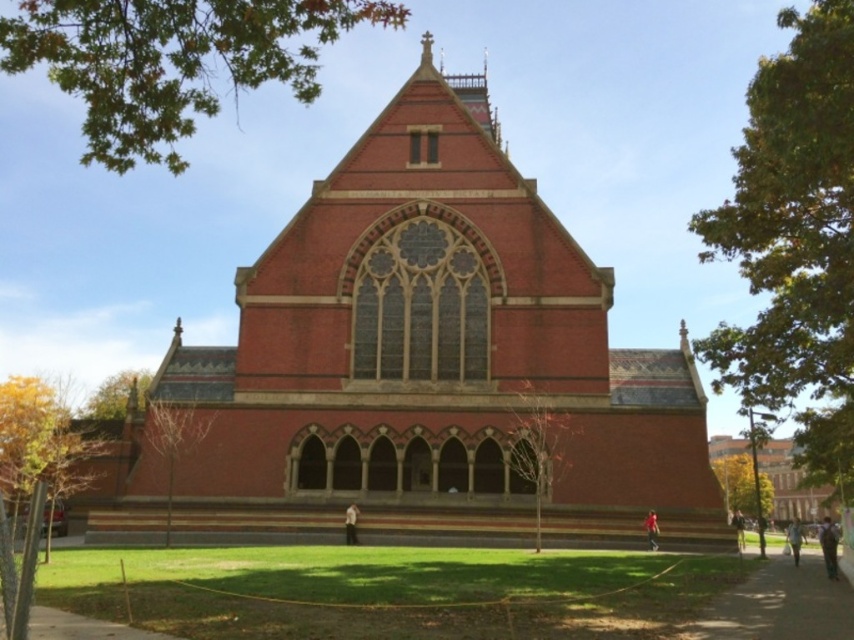
Question: Which object is closer to the camera taking this photo?

Choices:
 (A) red brick church at center
 (B) yellow-green leaves at lower left

Answer: (B)

Question: Is yellow-green leaves at lower left to the right of green leafy tree at right from the viewer's perspective?

Choices:
 (A) no
 (B) yes

Answer: (A)

Question: Is red brick church at center above green leafy tree at right?

Choices:
 (A) yes
 (B) no

Answer: (A)

Question: Which is farther from the yellow-green leaves at lower left?

Choices:
 (A) bare branches at lower left
 (B) green leafy tree at right

Answer: (B)

Question: Does green leafy branch at upper left come in front of bare wood tree at center?

Choices:
 (A) yes
 (B) no

Answer: (A)

Question: Estimate the real-world distances between objects in this image. Which object is farther from the bare wood tree at center?

Choices:
 (A) red brick church at center
 (B) bare branches at lower left

Answer: (B)